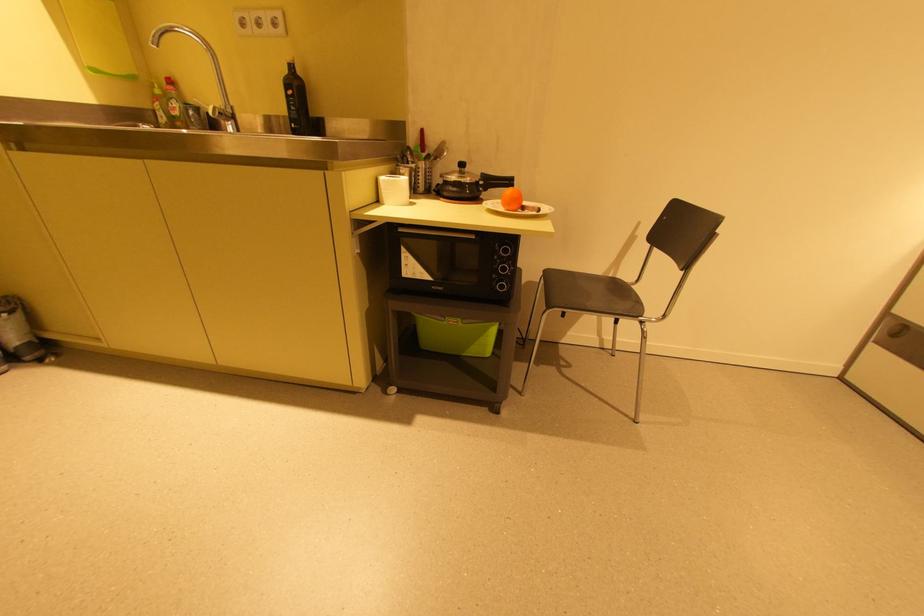
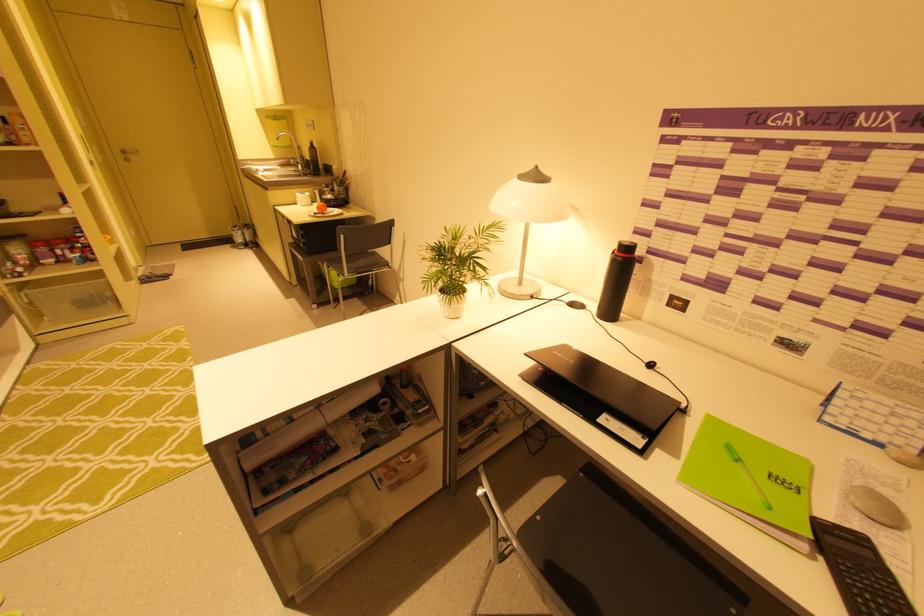
Where in the second image is the point corresponding to (x=289, y=71) from the first image?

(313, 146)